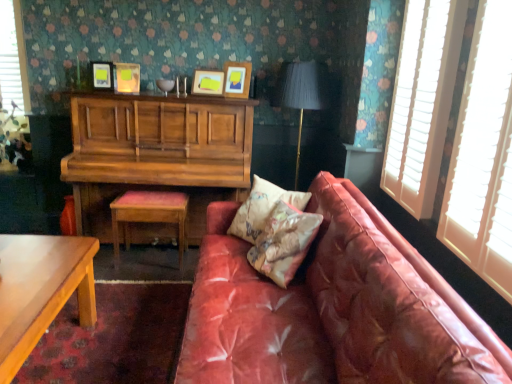
Question: Visually, is matte wooden picture frame at upper center, placed as the 2th picture frame when sorted from right to left, positioned to the left or to the right of matte black lampshade at center?

Choices:
 (A) left
 (B) right

Answer: (A)

Question: Considering the positions of point (222, 82) and point (304, 64), is point (222, 82) closer or farther from the camera than point (304, 64)?

Choices:
 (A) farther
 (B) closer

Answer: (A)

Question: Based on their relative distances, which object is nearer to the matte yellow picture frame at upper center, the 3th picture frame from the right?

Choices:
 (A) floral-patterned fabric pillow at center, the second pillow positioned from the front
 (B) wooden piano at upper left
 (C) smooth wooden table at lower left
 (D) wooden picture frame at upper center, the first picture frame when ordered from right to left
 (E) leather couch at center

Answer: (B)

Question: Which object is the farthest from the floral-patterned fabric pillow at center, the second pillow positioned from the front?

Choices:
 (A) matte black lampshade at center
 (B) wooden piano at upper left
 (C) white wood blinds at right
 (D) smooth wooden table at lower left
 (E) matte wooden picture frame at upper center, placed as the 2th picture frame when sorted from right to left

Answer: (D)